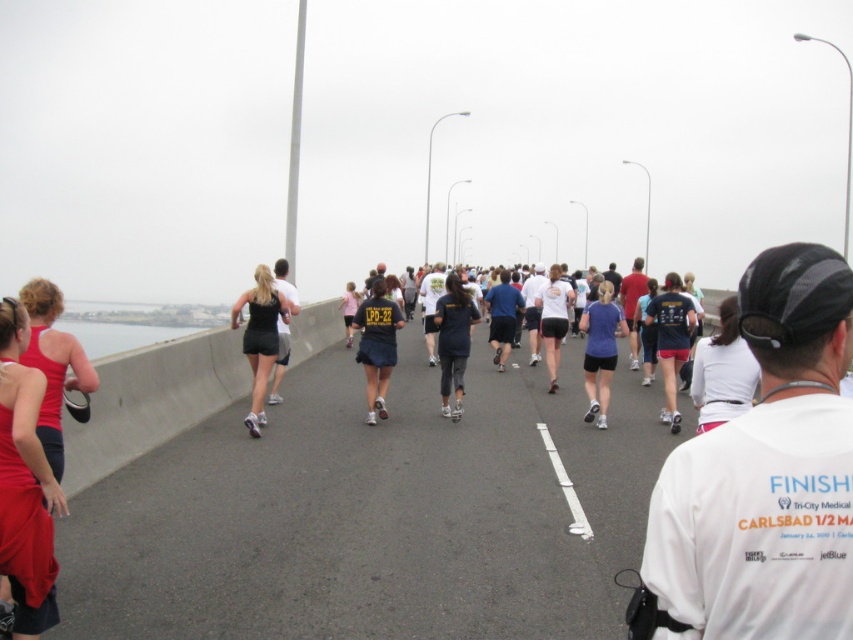
The height and width of the screenshot is (640, 853). What do you see at coordinates (553, 317) in the screenshot?
I see `white matte tank top at center` at bounding box center [553, 317].

Does white matte tank top at center have a lesser width compared to black fabric tank top at center?

Yes, white matte tank top at center is thinner than black fabric tank top at center.

Locate an element on the screen. white matte tank top at center is located at coordinates coord(553,317).

Can you confirm if matte red tank top at left is positioned above matte black shirt at center?

No, matte red tank top at left is not above matte black shirt at center.

Can you confirm if matte red tank top at left is positioned to the right of matte black shirt at center?

In fact, matte red tank top at left is to the left of matte black shirt at center.

Does point (3, 368) lie in front of point (666, 282)?

Yes, point (3, 368) is in front of point (666, 282).

Where is `matte red tank top at left`? This screenshot has width=853, height=640. matte red tank top at left is located at coordinates (24, 483).

Does matte red tank top at left have a smaller size compared to matte purple shirt at center?

Yes, matte red tank top at left is smaller than matte purple shirt at center.

Consider the image. Between matte red tank top at left and matte purple shirt at center, which one is positioned higher?

matte purple shirt at center is above.

Locate an element on the screen. matte red tank top at left is located at coordinates (24, 483).